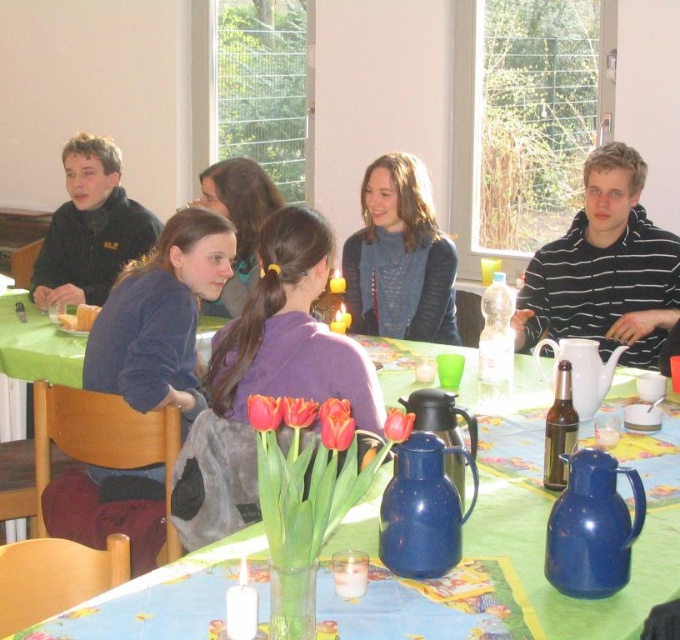
Question: Which is farther from the matte black jacket at upper left?

Choices:
 (A) white ceramic teapot at center
 (B) blue plastic thermos at lower right
 (C) blue sweater at center
 (D) black striped shirt at upper right

Answer: (B)

Question: Does white ceramic teapot at center have a greater width compared to blue ceramic thermos at center?

Choices:
 (A) yes
 (B) no

Answer: (A)

Question: Among these objects, which one is nearest to the camera?

Choices:
 (A) matte black jacket at upper left
 (B) blue plastic thermos at lower right

Answer: (B)

Question: Which of the following is the farthest from the observer?

Choices:
 (A) (454, 404)
 (B) (543, 522)
 (C) (396, 205)

Answer: (C)

Question: Does black striped shirt at upper right appear under blue enamel thermos at center?

Choices:
 (A) yes
 (B) no

Answer: (B)

Question: Considering the relative positions of blue ceramic jugs at center and blue enamel thermos at center in the image provided, where is blue ceramic jugs at center located with respect to blue enamel thermos at center?

Choices:
 (A) left
 (B) right

Answer: (B)